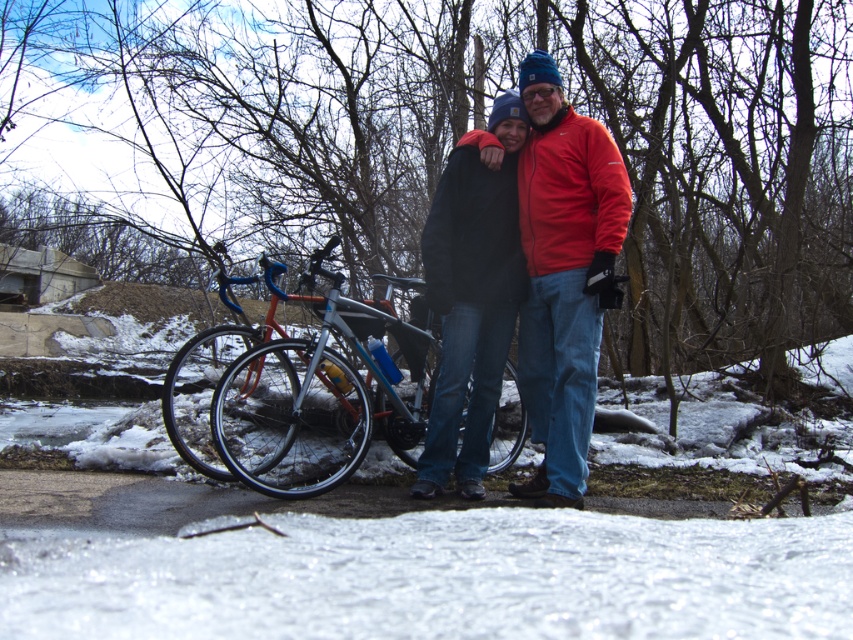
Is matte black jacket at center positioned behind black matte jacket at center?

No, it is not.

In the scene shown: Does matte black jacket at center appear under black matte jacket at center?

No.

The height and width of the screenshot is (640, 853). What do you see at coordinates (564, 275) in the screenshot? I see `matte black jacket at center` at bounding box center [564, 275].

Identify the location of matte black jacket at center. (564, 275).

Who is lower down, matte black jacket at center or shiny metallic bicycle at center?

shiny metallic bicycle at center is below.

Locate an element on the screen. The height and width of the screenshot is (640, 853). matte black jacket at center is located at coordinates (564, 275).

Consider the image. Is shiny metallic bicycle at center wider than black matte jacket at center?

Yes.

Who is positioned more to the right, shiny metallic bicycle at center or black matte jacket at center?

black matte jacket at center is more to the right.

Between point (305, 424) and point (491, 112), which one is positioned behind?

The point (305, 424) is behind.

Where is `shiny metallic bicycle at center`? The height and width of the screenshot is (640, 853). shiny metallic bicycle at center is located at coordinates (320, 397).